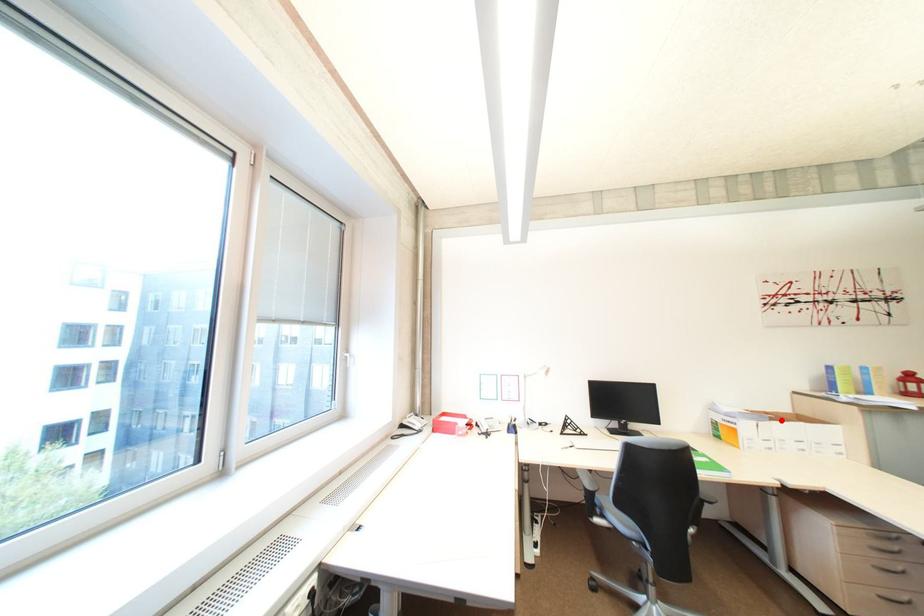
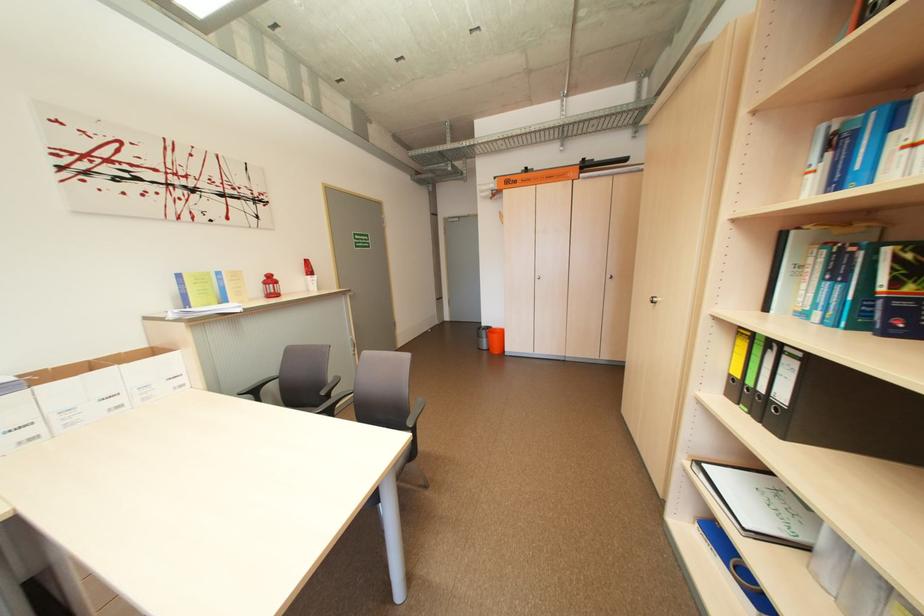
Find the pixel in the second image that matches the highlighted location in the first image.

(43, 384)